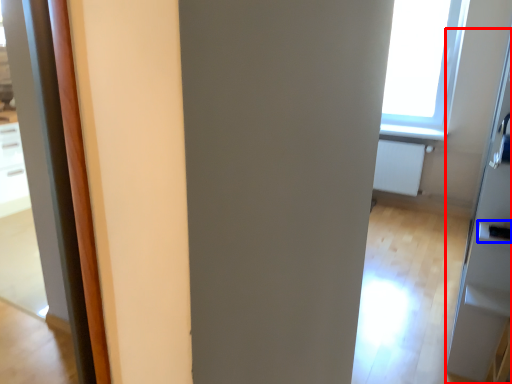
Question: Among these objects, which one is nearest to the camera, screen door (highlighted by a red box) or door handle (highlighted by a blue box)?

Choices:
 (A) screen door
 (B) door handle

Answer: (A)